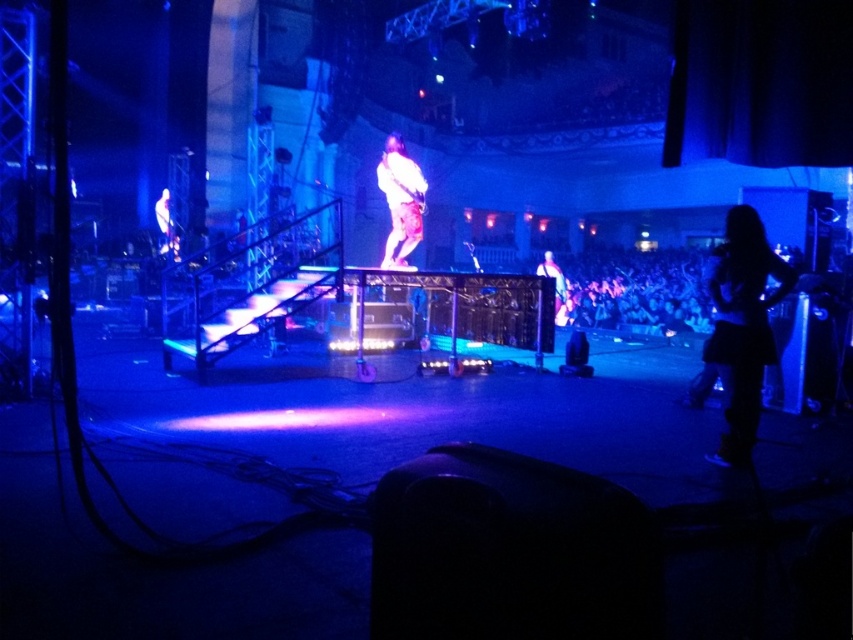
You are a stagehand preparing to adjust the lighting for the performance. You need to ensure that the black matte skirt at lower right and the white fabric at upper left are both visible under the stage lights. Considering their thickness, which object might require more focused lighting to be clearly seen?

The black matte skirt at lower right is thinner than the white fabric at upper left, so it might require more focused lighting to ensure its details are visible since thinner materials can sometimes be less reflective and harder to illuminate clearly.

You are a stagehand who needs to move a 10 feet long extension cord from the black matte skirt at lower right to the shiny purple guitar at center. Can you place the cord directly between them without bending it?

The distance between the black matte skirt at lower right and the shiny purple guitar at center is 12.66 feet. Since the extension cord is only 10 feet long, it is not long enough to reach between them without bending.

You are a stagehand preparing to adjust the lighting for the guitarist. You need to position a spotlight so it shines directly above the shiny silver guitar at center without illuminating the black matte skirt at lower right. Based on their positions, is this possible?

The black matte skirt at lower right is below the shiny silver guitar at center, so positioning a spotlight directly above the guitar would also illuminate the skirt. Therefore, it is not possible to shine the spotlight above the guitar without affecting the skirt.